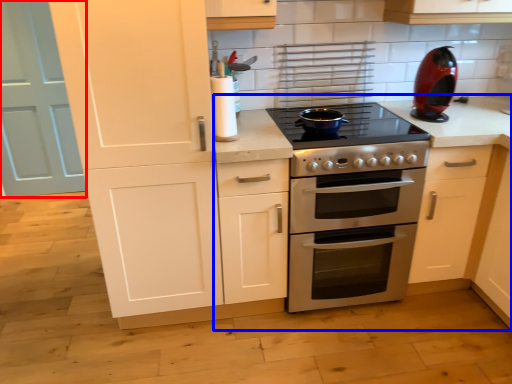
Question: Which object is closer to the camera taking this photo, door (highlighted by a red box) or countertop (highlighted by a blue box)?

Choices:
 (A) door
 (B) countertop

Answer: (B)